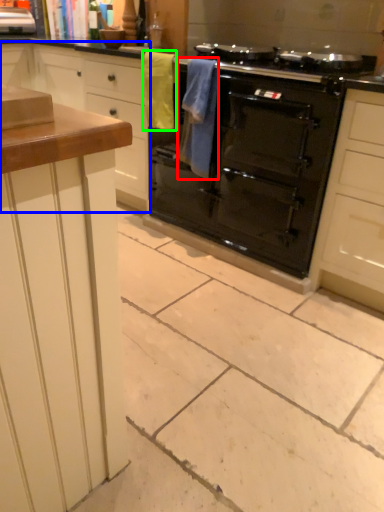
Question: Estimate the real-world distances between objects in this image. Which object is closer to material (highlighted by a red box), cabinetry (highlighted by a blue box) or material (highlighted by a green box)?

Choices:
 (A) cabinetry
 (B) material

Answer: (B)